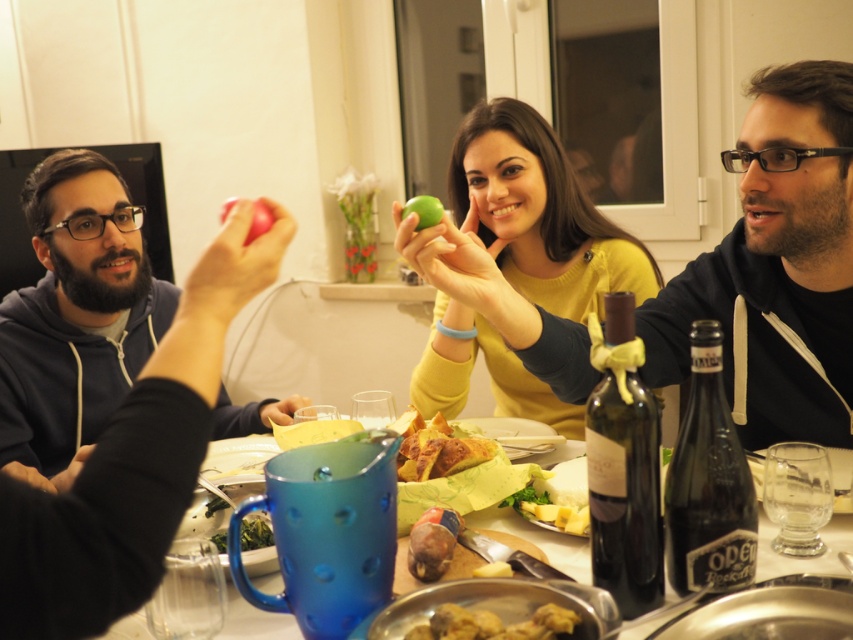
Question: Does green matte apple at center have a greater width compared to golden crispy pastry at center?

Choices:
 (A) yes
 (B) no

Answer: (A)

Question: Among these points, which one is nearest to the camera?

Choices:
 (A) (480, 636)
 (B) (222, 205)
 (C) (70, 298)
 (D) (439, 452)

Answer: (A)

Question: Is matte black hoodie at upper left closer to camera compared to green matte apple at center?

Choices:
 (A) yes
 (B) no

Answer: (A)

Question: Which of the following is the farthest from the observer?

Choices:
 (A) green matte apple at center
 (B) matte black hoodie at upper left
 (C) matte red apple at upper center

Answer: (A)

Question: In this image, where is golden brown meatballs at lower center located relative to matte red apple at upper center?

Choices:
 (A) right
 (B) left

Answer: (A)

Question: Which object is positioned farthest from the matte black hoodie at upper left?

Choices:
 (A) matte black hoodie at center
 (B) matte red apple at upper center
 (C) golden crispy pastry at center

Answer: (B)